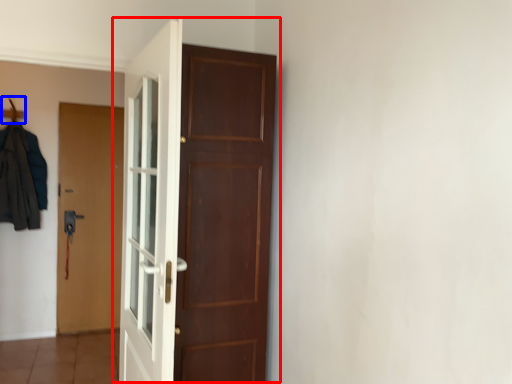
Question: Which of the following is the farthest to the observer, door (highlighted by a red box) or hanger (highlighted by a blue box)?

Choices:
 (A) door
 (B) hanger

Answer: (B)